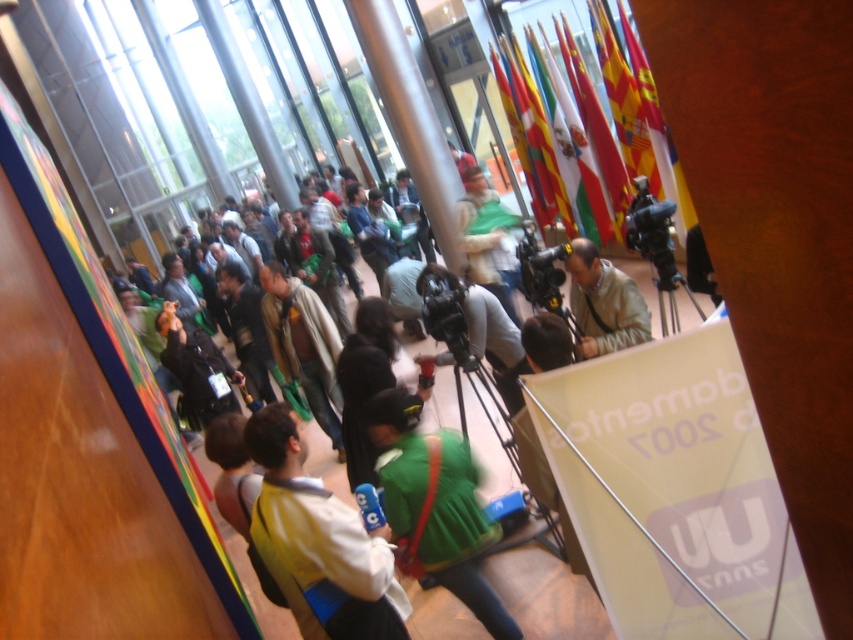
You are organizing a photo shoot and need to arrange two jackets, the yellow fabric jacket at center and the beige fabric jacket at center, on a mannequin. Which jacket should you place first if you want the larger one to be more prominent?

The yellow fabric jacket at center is larger in size than the beige fabric jacket at center, so you should place the yellow fabric jacket at center first to make it more prominent.